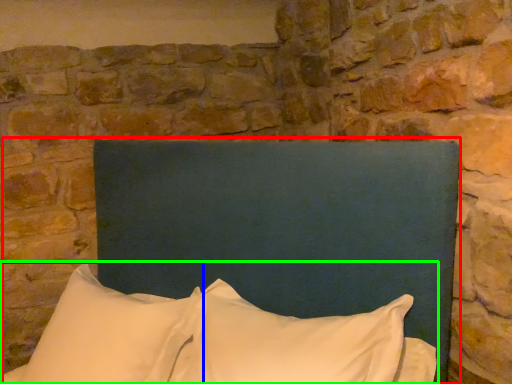
Question: Which object is positioned closest to bed (highlighted by a red box)? Select from pillow (highlighted by a blue box) and pillow (highlighted by a green box).

Choices:
 (A) pillow
 (B) pillow

Answer: (B)